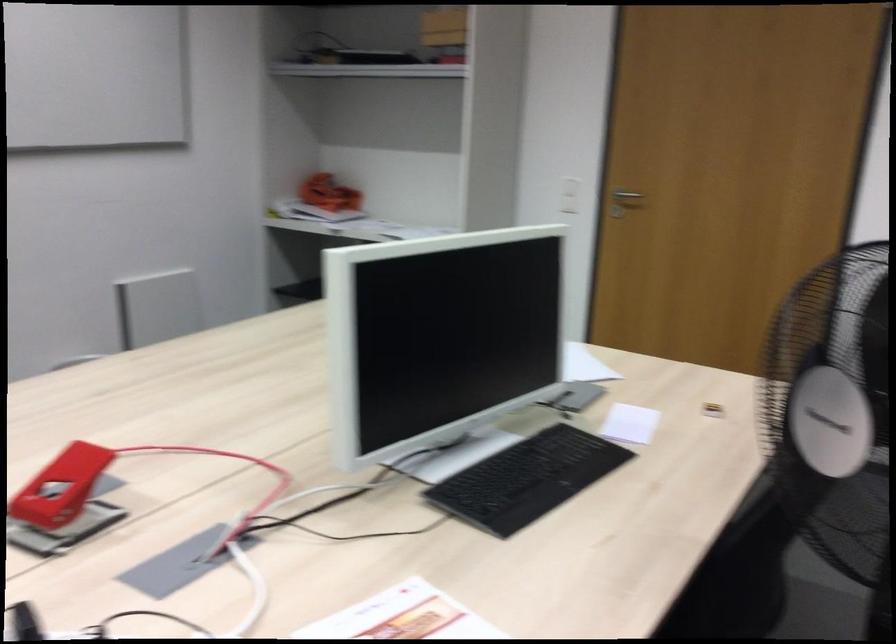
The width and height of the screenshot is (896, 644). What do you see at coordinates (569, 194) in the screenshot?
I see `the white light switch` at bounding box center [569, 194].